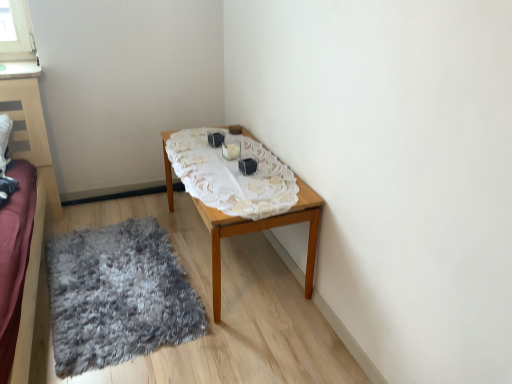
Question: Is wooden table at center shorter than gray shaggy rug at lower left?

Choices:
 (A) yes
 (B) no

Answer: (B)

Question: Considering the relative positions of wooden table at center and gray shaggy rug at lower left in the image provided, is wooden table at center in front of gray shaggy rug at lower left?

Choices:
 (A) no
 (B) yes

Answer: (A)

Question: Is wooden table at center oriented towards gray shaggy rug at lower left?

Choices:
 (A) no
 (B) yes

Answer: (B)

Question: Considering the relative sizes of wooden table at center and gray shaggy rug at lower left in the image provided, is wooden table at center thinner than gray shaggy rug at lower left?

Choices:
 (A) no
 (B) yes

Answer: (B)

Question: From a real-world perspective, is wooden table at center below gray shaggy rug at lower left?

Choices:
 (A) yes
 (B) no

Answer: (B)

Question: Is gray shaggy rug at lower left bigger or smaller than white lace tablecloth at center?

Choices:
 (A) small
 (B) big

Answer: (B)

Question: Considering the relative positions of gray shaggy rug at lower left and white lace tablecloth at center in the image provided, is gray shaggy rug at lower left to the left or to the right of white lace tablecloth at center?

Choices:
 (A) left
 (B) right

Answer: (A)

Question: Considering their positions, is gray shaggy rug at lower left located in front of or behind white lace tablecloth at center?

Choices:
 (A) front
 (B) behind

Answer: (A)

Question: Considering the positions of gray shaggy rug at lower left and white lace tablecloth at center in the image, is gray shaggy rug at lower left taller or shorter than white lace tablecloth at center?

Choices:
 (A) tall
 (B) short

Answer: (A)

Question: From the image's perspective, relative to gray shaggy rug at lower left, is wooden table at center above or below?

Choices:
 (A) below
 (B) above

Answer: (B)

Question: Is point 168,183 positioned closer to the camera than point 122,339?

Choices:
 (A) farther
 (B) closer

Answer: (A)

Question: Considering their positions, is wooden table at center located in front of or behind gray shaggy rug at lower left?

Choices:
 (A) front
 (B) behind

Answer: (B)

Question: Is wooden table at center to the left or to the right of gray shaggy rug at lower left in the image?

Choices:
 (A) left
 (B) right

Answer: (B)

Question: Does point (266, 168) appear closer or farther from the camera than point (118, 327)?

Choices:
 (A) closer
 (B) farther

Answer: (B)

Question: From the image's perspective, is white lace tablecloth at center positioned above or below gray shaggy rug at lower left?

Choices:
 (A) below
 (B) above

Answer: (B)